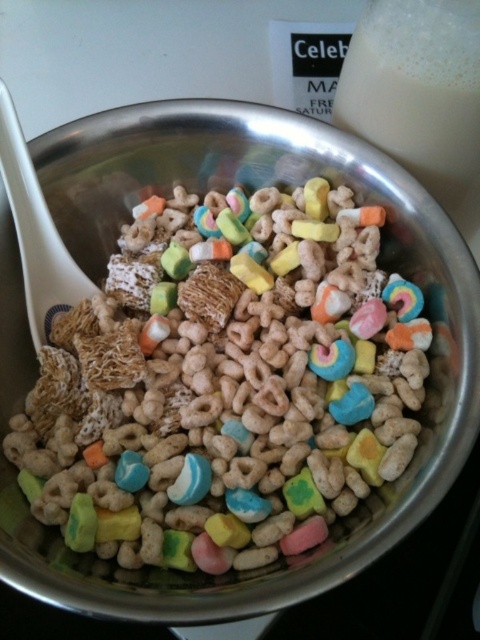
Does white frothy milk at upper right have a greater height compared to white plastic spoon at left?

In fact, white frothy milk at upper right may be shorter than white plastic spoon at left.

Which is in front, point (359, 65) or point (69, 280)?

Point (359, 65) is more forward.

Is point (442, 48) behind point (35, 211)?

No, it is in front of (35, 211).

The image size is (480, 640). Identify the location of white frothy milk at upper right. (420, 97).

Which is below, colorful cereal at center or white frothy milk at upper right?

colorful cereal at center is lower down.

Is colorful cereal at center wider than white frothy milk at upper right?

Correct, the width of colorful cereal at center exceeds that of white frothy milk at upper right.

The width and height of the screenshot is (480, 640). Identify the location of colorful cereal at center. (225, 385).

Is colorful cereal at center to the left of white plastic spoon at left from the viewer's perspective?

No, colorful cereal at center is not to the left of white plastic spoon at left.

Is colorful cereal at center to the right of white plastic spoon at left from the viewer's perspective?

Correct, you'll find colorful cereal at center to the right of white plastic spoon at left.

The height and width of the screenshot is (640, 480). Describe the element at coordinates (225, 385) in the screenshot. I see `colorful cereal at center` at that location.

At what (x,y) coordinates should I click in order to perform the action: click on colorful cereal at center. Please return your answer as a coordinate pair (x, y). Looking at the image, I should click on (225, 385).